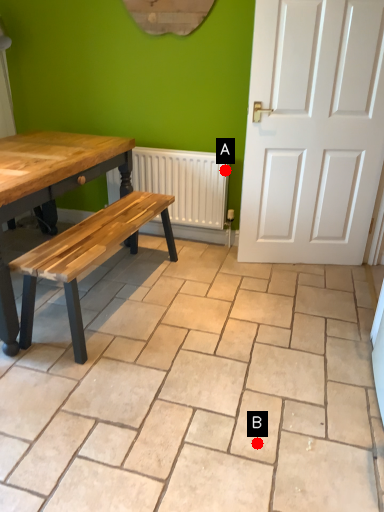
Question: Two points are circled on the image, labeled by A and B beside each circle. Which point is farther to the camera?

Choices:
 (A) A is further
 (B) B is further

Answer: (A)